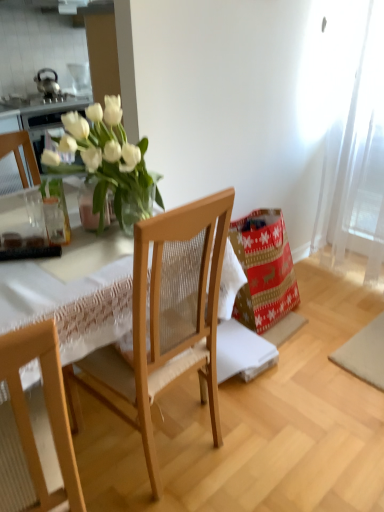
Find the location of a particular element. Image resolution: width=384 pixels, height=512 pixels. vacant space in front of red and gold paper bag at lower right is located at coordinates (308, 353).